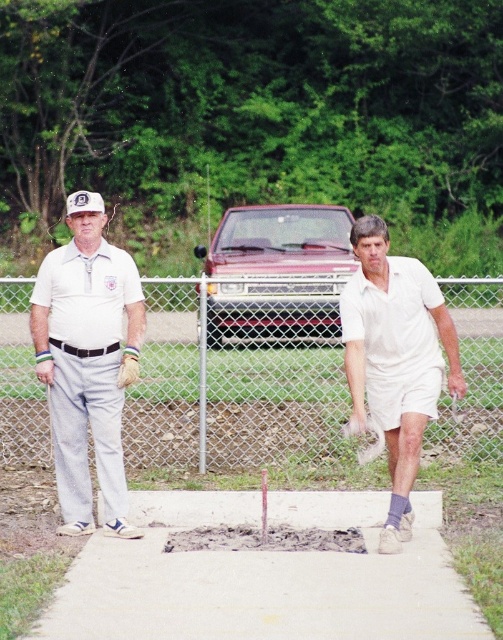
Question: Is gray concrete hole at center below white cotton shirt at left?

Choices:
 (A) no
 (B) yes

Answer: (B)

Question: Among these points, which one is nearest to the camera?

Choices:
 (A) (443, 324)
 (B) (178, 636)
 (C) (90, 310)

Answer: (B)

Question: Observing the image, what is the correct spatial positioning of white cotton shirt at left in reference to white cotton shirt at center?

Choices:
 (A) below
 (B) above

Answer: (B)

Question: Which point appears closest to the camera in this image?

Choices:
 (A) (309, 401)
 (B) (51, 611)
 (C) (445, 342)
 (D) (131, 296)

Answer: (B)

Question: Can you confirm if white cotton shirt at left is wider than white cotton shirt at center?

Choices:
 (A) yes
 (B) no

Answer: (A)

Question: Which object appears farthest from the camera in this image?

Choices:
 (A) metal chain-link fence at center
 (B) white cotton shirt at center

Answer: (A)